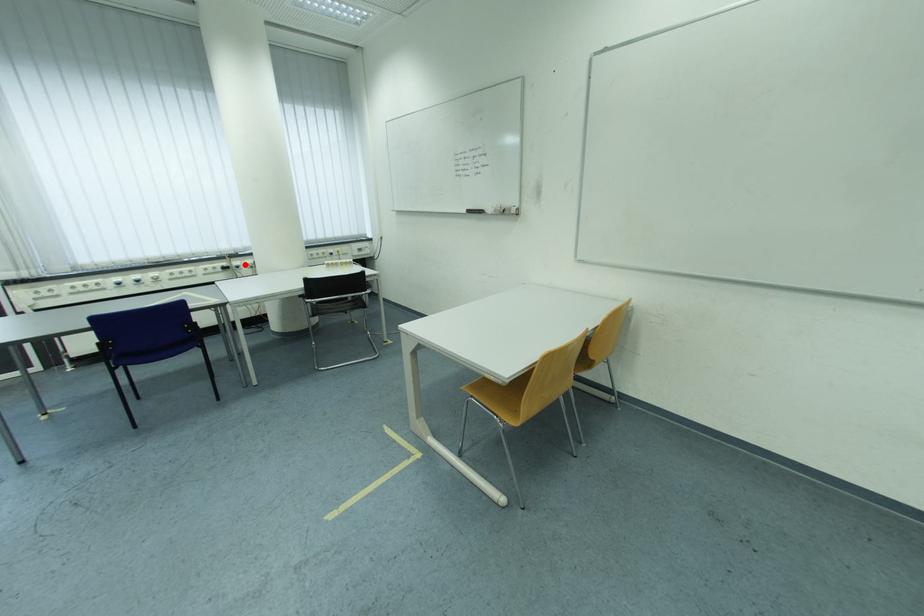
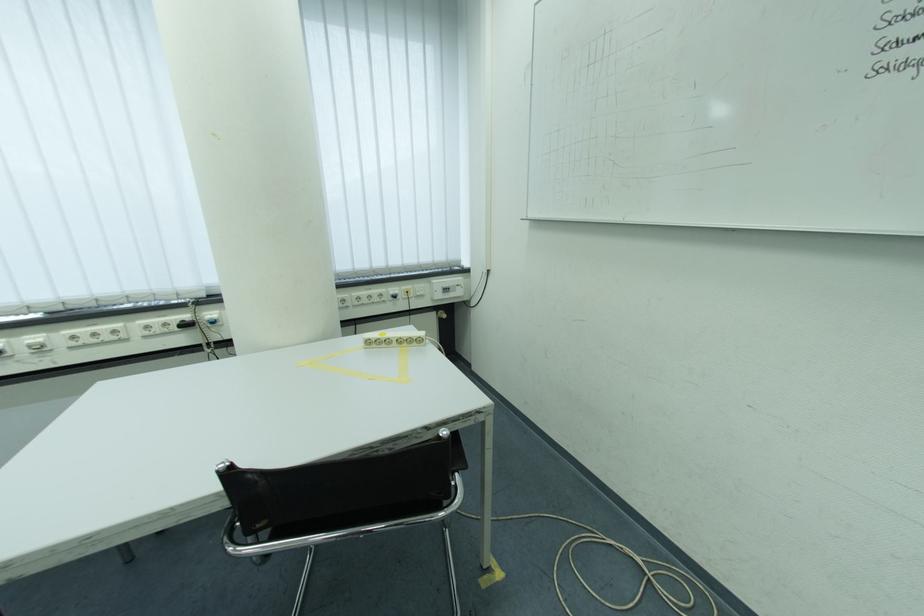
Question: I am providing you with two images of the same scene from different viewpoints. A red point is marked on the first image. Is the red point's position out of view in image 2?

Choices:
 (A) Yes
 (B) No

Answer: (B)